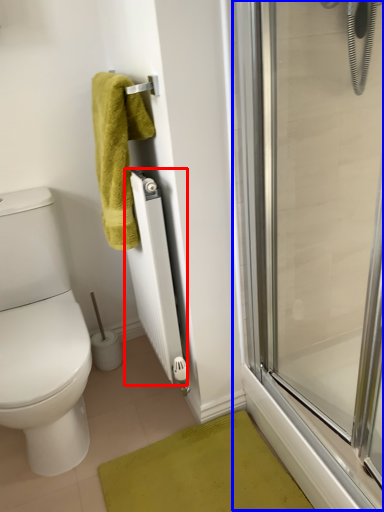
Question: Which object is further to the camera taking this photo, radiator (highlighted by a red box) or screen door (highlighted by a blue box)?

Choices:
 (A) radiator
 (B) screen door

Answer: (A)